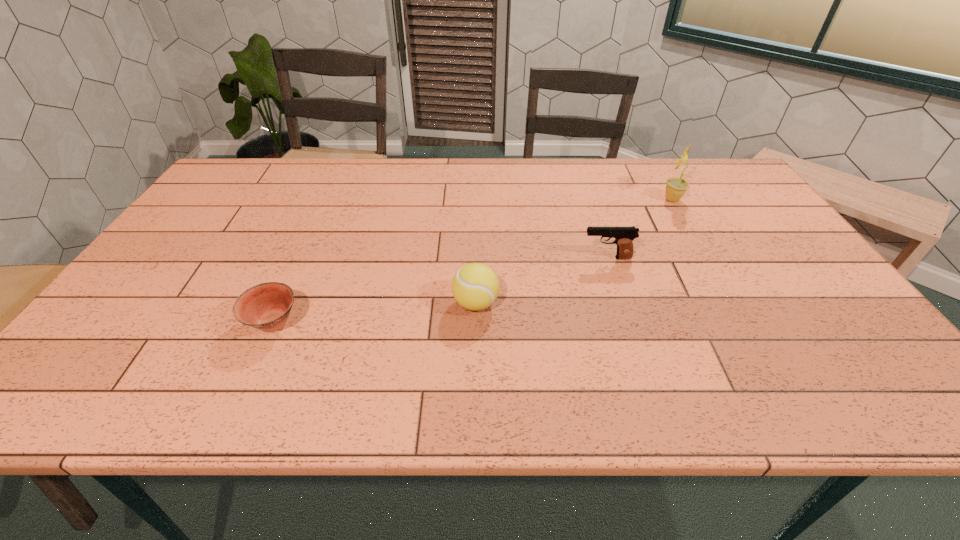
Identify which object is located as the nearest to the tennis ball. Please provide its 2D coordinates. Your answer should be formatted as a tuple, i.e. [(x, y)], where the tuple contains the x and y coordinates of a point satisfying the conditions above.

[(624, 236)]

At what (x,y) coordinates should I click in order to perform the action: click on object that can be found as the third closest to the pistol. Please return your answer as a coordinate pair (x, y). The image size is (960, 540). Looking at the image, I should click on (266, 306).

Locate an element on the screen. free space that satisfies the following two spatial constraints: 1. on the back side of the third object from right to left; 2. on the right side of the bowl is located at coordinates 282,303.

The height and width of the screenshot is (540, 960). I want to click on free space that satisfies the following two spatial constraints: 1. on the back side of the bowl; 2. on the left side of the third object from right to left, so click(x=282, y=303).